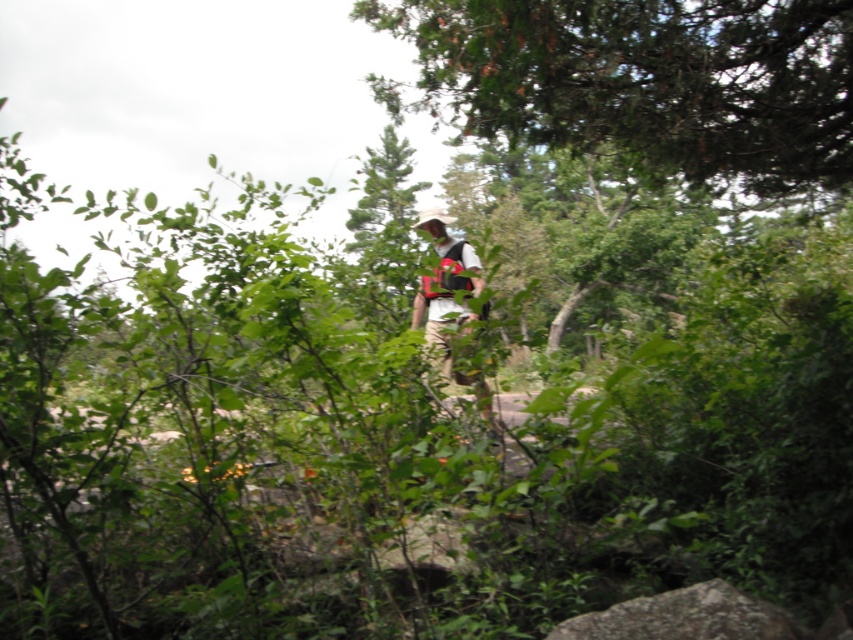
Is point (434, 92) closer to viewer compared to point (492, 422)?

No.

Is point (624, 104) closer to camera compared to point (473, 266)?

Yes, point (624, 104) is in front of point (473, 266).

In order to click on green leafy tree at upper center in this screenshot , I will do `click(647, 80)`.